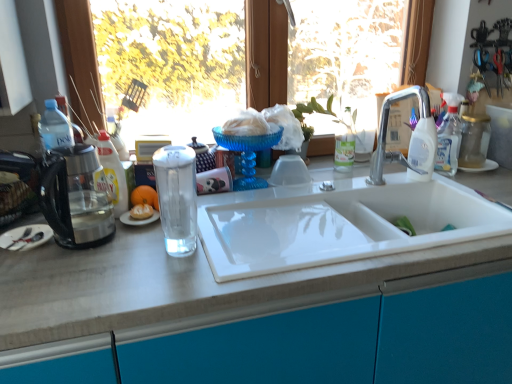
Identify the location of free space that is in between clear glass water at center and silver metallic faucet at upper right. (274, 221).